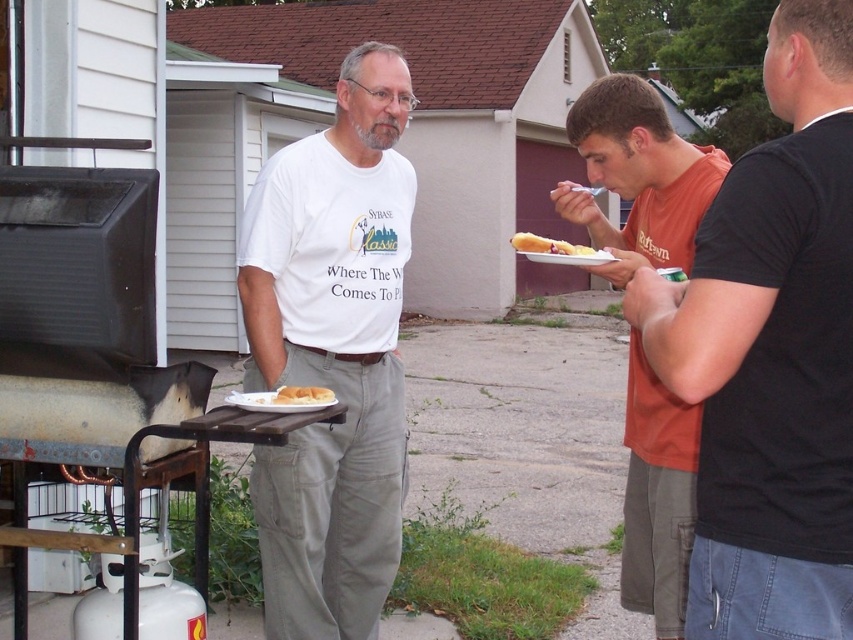
Question: Does orange t-shirt at center have a smaller size compared to yellowish bread at center?

Choices:
 (A) no
 (B) yes

Answer: (B)

Question: Does yellowish bread at center appear over golden fried chicken at center?

Choices:
 (A) no
 (B) yes

Answer: (B)

Question: Which of the following is the closest to the observer?

Choices:
 (A) orange cotton shirt at right
 (B) white matte t-shirt at center
 (C) white matte bread at center

Answer: (A)

Question: Which point is closer to the camera?

Choices:
 (A) orange cotton shirt at right
 (B) golden fried chicken at center
 (C) yellowish bread at center

Answer: (A)

Question: Among these objects, which one is nearest to the camera?

Choices:
 (A) orange cotton shirt at right
 (B) white matte bread at center
 (C) orange t-shirt at center

Answer: (A)

Question: Is orange cotton shirt at right wider than golden fried chicken at center?

Choices:
 (A) yes
 (B) no

Answer: (A)